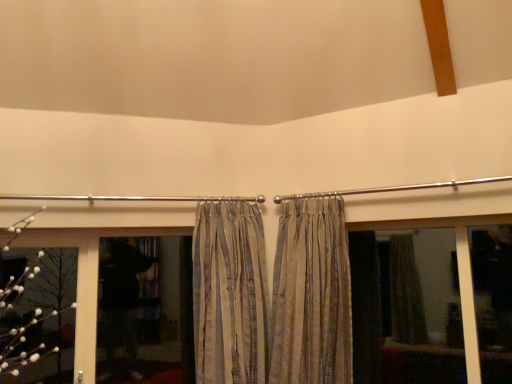
Question: In which direction should I rotate to look at silky beige curtains at center, the first curtain in the right-to-left sequence?

Choices:
 (A) right
 (B) left

Answer: (A)

Question: Can white fluffy flower at left be found inside matte glass window at center?

Choices:
 (A) yes
 (B) no

Answer: (B)

Question: Does matte glass window at center turn towards white fluffy flower at left?

Choices:
 (A) no
 (B) yes

Answer: (A)

Question: Is matte glass window at center positioned far away from white fluffy flower at left?

Choices:
 (A) yes
 (B) no

Answer: (A)

Question: Is matte glass window at center beside white fluffy flower at left?

Choices:
 (A) no
 (B) yes

Answer: (A)

Question: Is matte glass window at center wider than white fluffy flower at left?

Choices:
 (A) yes
 (B) no

Answer: (A)

Question: Considering the relative sizes of matte glass window at center and white fluffy flower at left in the image provided, is matte glass window at center shorter than white fluffy flower at left?

Choices:
 (A) no
 (B) yes

Answer: (A)

Question: Could you tell me if white fluffy flower at left is facing striped fabric curtain at center, placed as the first curtain when sorted from left to right?

Choices:
 (A) yes
 (B) no

Answer: (B)

Question: Is striped fabric curtain at center, placed as the second curtain when sorted from right to left, located within white fluffy flower at left?

Choices:
 (A) yes
 (B) no

Answer: (B)

Question: Can you confirm if white fluffy flower at left is smaller than striped fabric curtain at center, placed as the second curtain when sorted from right to left?

Choices:
 (A) no
 (B) yes

Answer: (B)

Question: Is striped fabric curtain at center, placed as the second curtain when sorted from right to left, at the back of white fluffy flower at left?

Choices:
 (A) yes
 (B) no

Answer: (B)

Question: From a real-world perspective, is white fluffy flower at left positioned under striped fabric curtain at center, placed as the second curtain when sorted from right to left, based on gravity?

Choices:
 (A) yes
 (B) no

Answer: (A)

Question: Does white fluffy flower at left have a lesser height compared to striped fabric curtain at center, placed as the first curtain when sorted from left to right?

Choices:
 (A) yes
 (B) no

Answer: (A)

Question: Is matte glass window at center at the right side of silky beige curtains at center, the first curtain in the right-to-left sequence?

Choices:
 (A) yes
 (B) no

Answer: (A)